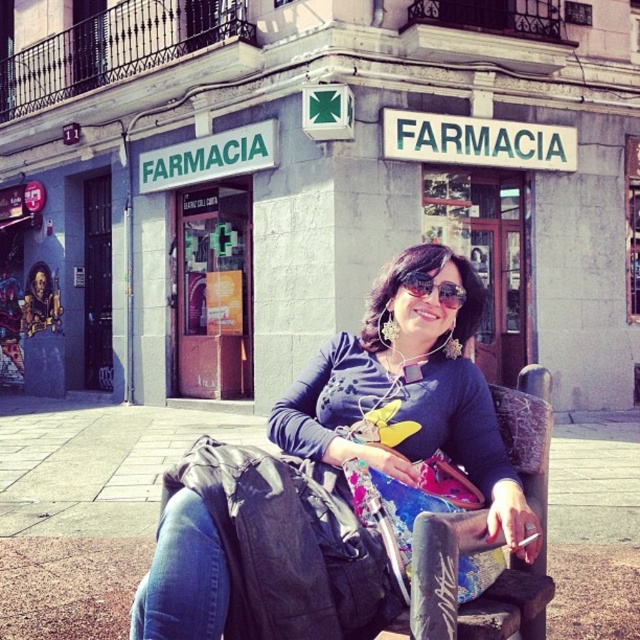
Question: Which object appears closest to the camera in this image?

Choices:
 (A) matte black jacket at center
 (B) sunglasses at center
 (C) denim at lower left

Answer: (C)

Question: Which of these objects is positioned farthest from the denim at lower left?

Choices:
 (A) sunglasses at center
 (B) matte black jacket at center

Answer: (A)

Question: Does matte black jacket at center have a lesser width compared to denim at lower left?

Choices:
 (A) no
 (B) yes

Answer: (A)

Question: Can you confirm if matte black jacket at center is positioned to the right of denim at lower left?

Choices:
 (A) no
 (B) yes

Answer: (B)

Question: Does denim at lower left lie behind sunglasses at center?

Choices:
 (A) no
 (B) yes

Answer: (A)

Question: Which object is the closest to the sunglasses at center?

Choices:
 (A) denim at lower left
 (B) matte black jacket at center

Answer: (B)